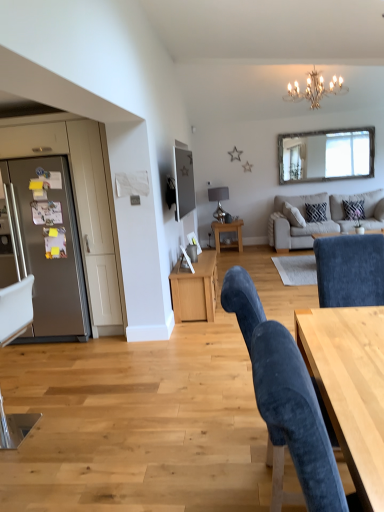
Question: Choose the correct answer: Is zebra-patterned fabric pillow at upper right, the 2th pillow in the left-to-right sequence, inside velvet blue chair at lower right, which is the second chair from back to front, or outside it?

Choices:
 (A) outside
 (B) inside

Answer: (A)

Question: Is zebra-patterned fabric pillow at upper right, the first pillow when ordered from right to left, in front of or behind velvet blue chair at lower right, which ranks as the first chair in right-to-left order, in the image?

Choices:
 (A) behind
 (B) front

Answer: (A)

Question: Based on their relative distances, which object is nearer to the matte black tv at upper center?

Choices:
 (A) wooden side table at center
 (B) matte silver lampshade at center, marked as the second lamp in a front-to-back arrangement
 (C) metallic silver chair at left, the 2th chair in the right-to-left sequence
 (D) clear glass mirror at upper center
 (E) gold metallic chandelier at upper center, arranged as the 1th lamp when viewed from the right

Answer: (A)

Question: Estimate the real-world distances between objects in this image. Which object is farther from the zebra-patterned fabric pillow at upper right, the first pillow when ordered from right to left?

Choices:
 (A) satin silver refrigerator at left
 (B) wooden side table at center
 (C) velvet blue chair at lower right, which is the second chair from back to front
 (D) light wood desk at lower right
 (E) beige fabric couch at upper right

Answer: (C)